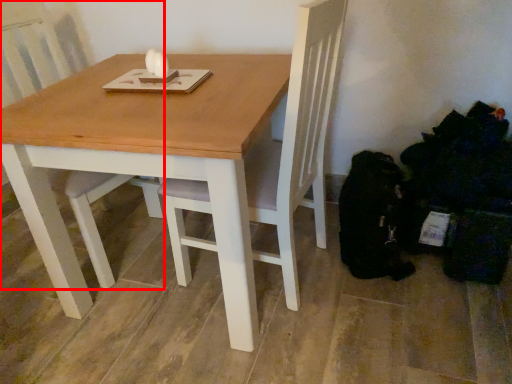
Question: From the image's perspective, where is chair (annotated by the red box) located relative to table?

Choices:
 (A) above
 (B) below

Answer: (A)